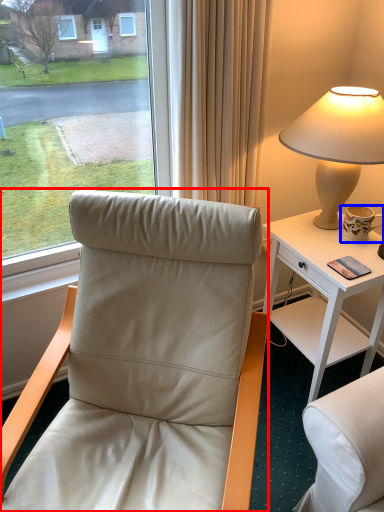
Question: Which of the following is the farthest to the observer, chair (highlighted by a red box) or coffee cup (highlighted by a blue box)?

Choices:
 (A) chair
 (B) coffee cup

Answer: (B)